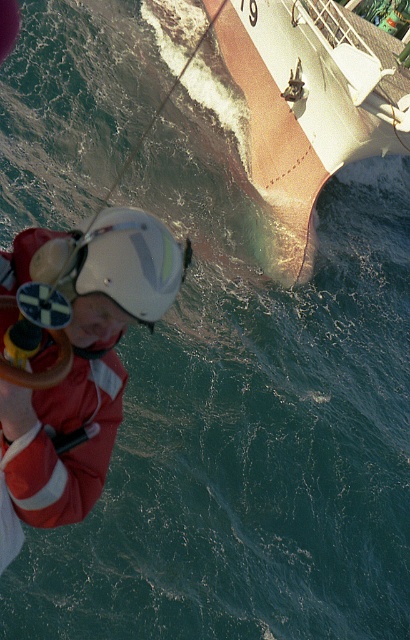
You are a maritime safety officer reviewing a distress scene image. You see a point at coordinates [311,104]. What object is located at that point?

The point at coordinates [311,104] indicates a smooth pinkish boat at upper center.

You are a safety inspector checking the visibility of equipment in a maritime scene. The red reflective jacket at left and the smooth pinkish boat at upper center are both critical for rescue operations. Which object is shorter in height?

The red reflective jacket at left is shorter than the smooth pinkish boat at upper center.